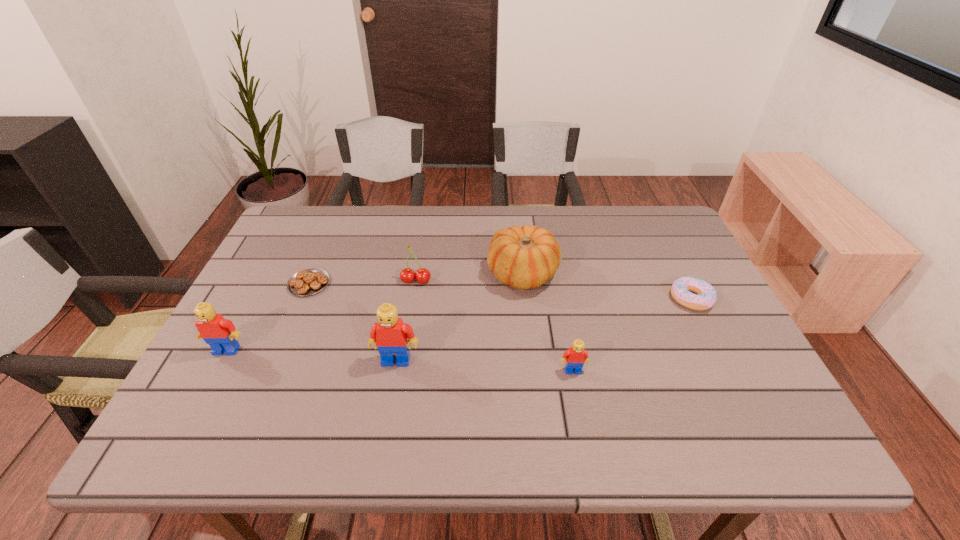
Where is `blank space located 0.050m on the face of the leftmost object`? blank space located 0.050m on the face of the leftmost object is located at coordinates (214, 374).

You are a GUI agent. You are given a task and a screenshot of the screen. Output one action in this format:
    pyautogui.click(x=<x>, y=<y>)
    Task: Click on the free location located on the left of the doughnut
    
    Given the screenshot: What is the action you would take?
    pyautogui.click(x=538, y=299)

Where is `vacant point located 0.080m on the left of the gourd`? vacant point located 0.080m on the left of the gourd is located at coordinates (459, 274).

The image size is (960, 540). Find the location of `vacant space located 0.120m with the stems of the cherry pointing upwards`. vacant space located 0.120m with the stems of the cherry pointing upwards is located at coordinates (410, 319).

Identify the location of vacant space located on the right of the sixth object from right to left. (358, 284).

Locate an element on the screen. The width and height of the screenshot is (960, 540). object positioned at the near edge is located at coordinates (576, 356).

Where is `Lego situated at the left edge`? Lego situated at the left edge is located at coordinates (221, 335).

Image resolution: width=960 pixels, height=540 pixels. Find the location of `pastry present at the left edge`. pastry present at the left edge is located at coordinates (310, 281).

Where is `object that is positioned at the right edge`? This screenshot has width=960, height=540. object that is positioned at the right edge is located at coordinates (680, 290).

Where is `vacant area at the far edge`? The image size is (960, 540). vacant area at the far edge is located at coordinates (441, 236).